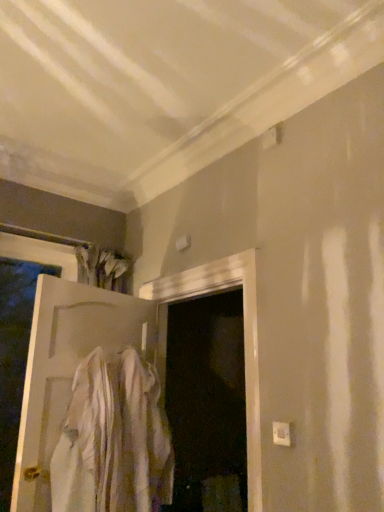
Question: Looking at the image, does white matte door at left seem bigger or smaller compared to white cotton shirt at center?

Choices:
 (A) big
 (B) small

Answer: (A)

Question: From the image's perspective, is white matte door at left above or below white cotton shirt at center?

Choices:
 (A) above
 (B) below

Answer: (A)

Question: Relative to white cotton shirt at center, is white matte door at left in front or behind?

Choices:
 (A) behind
 (B) front

Answer: (A)

Question: From their relative heights in the image, would you say white cotton shirt at center is taller or shorter than white matte door at left?

Choices:
 (A) short
 (B) tall

Answer: (A)

Question: From a real-world perspective, relative to white matte door at left, is white cotton shirt at center vertically above or below?

Choices:
 (A) above
 (B) below

Answer: (B)

Question: From the image's perspective, relative to white matte door at left, is white cotton shirt at center above or below?

Choices:
 (A) below
 (B) above

Answer: (A)

Question: Based on their sizes in the image, would you say white cotton shirt at center is bigger or smaller than white matte door at left?

Choices:
 (A) big
 (B) small

Answer: (B)